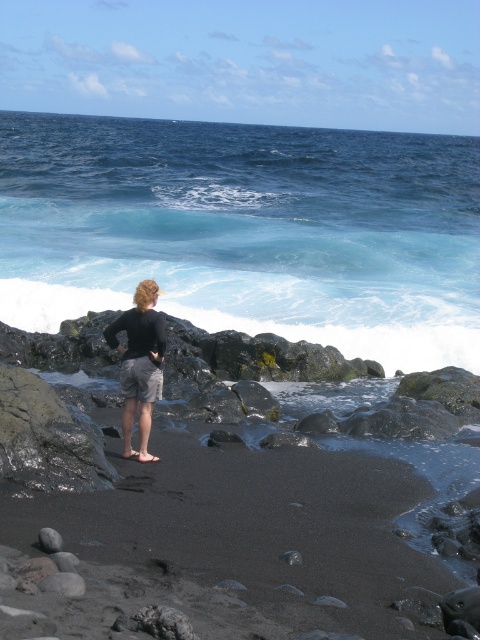
Question: Can you confirm if blue liquid water at center is smaller than black matte shorts at center?

Choices:
 (A) yes
 (B) no

Answer: (B)

Question: Among these points, which one is farthest from the camera?

Choices:
 (A) click(x=383, y=326)
 (B) click(x=151, y=292)

Answer: (A)

Question: Can you confirm if blue liquid water at center is positioned to the left of black matte shorts at center?

Choices:
 (A) yes
 (B) no

Answer: (B)

Question: Which point is farther to the camera?

Choices:
 (A) blue liquid water at center
 (B) black matte shorts at center

Answer: (A)

Question: Can you confirm if blue liquid water at center is thinner than black matte shorts at center?

Choices:
 (A) yes
 (B) no

Answer: (B)

Question: Among these points, which one is nearest to the camera?

Choices:
 (A) (155, 305)
 (B) (343, 228)

Answer: (A)